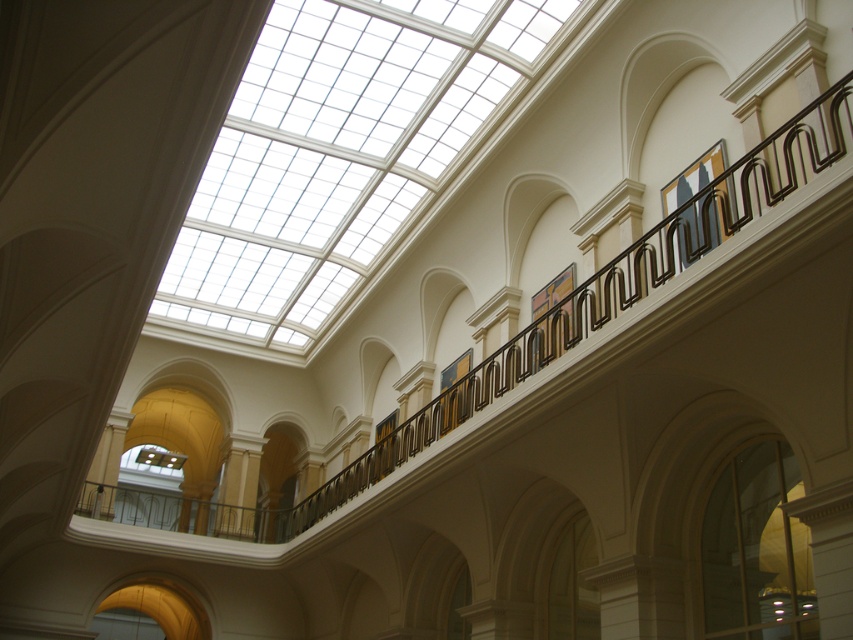
You are an architect examining the interior of a museum. You notice the transparent glass skylight at upper center and the transparent glass window at lower right. Which of these two glass features is closer to your current position?

The transparent glass skylight at upper center is closer to the viewer than the transparent glass window at lower right.

You are an architect designing a new lighting system for the museum. You need to decide which of the two transparent glass openings, the transparent glass skylight at upper center or the transparent glass window at lower right, will provide more natural light. Based on their sizes, which one would you choose?

The transparent glass skylight at upper center is much taller than the transparent glass window at lower right, so it would provide more natural light.

You are an interior designer assessing the lighting in the museum. You notice the transparent glass skylight at upper center and the matte black painting at upper right. Which object allows more natural light into the room?

The transparent glass skylight at upper center allows more natural light into the room because it is larger than the matte black painting at upper right.